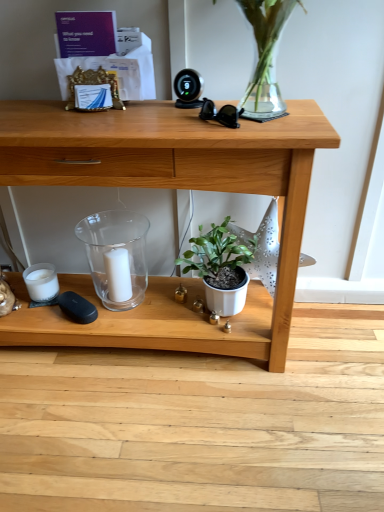
Question: Based on their sizes in the image, would you say transparent glass candle holder at center is bigger or smaller than white matte candle at center?

Choices:
 (A) big
 (B) small

Answer: (A)

Question: From the image's perspective, is transparent glass candle holder at center located above or below white matte candle at center?

Choices:
 (A) below
 (B) above

Answer: (B)

Question: Estimate the real-world distances between objects in this image. Which object is farther from the transparent glass candle holder at center?

Choices:
 (A) wooden desk at center
 (B) white matte candle at center
 (C) white matte pot at center

Answer: (C)

Question: Based on their relative distances, which object is farther from the wooden desk at center?

Choices:
 (A) white matte candle at center
 (B) white matte pot at center
 (C) transparent glass candle holder at center

Answer: (A)